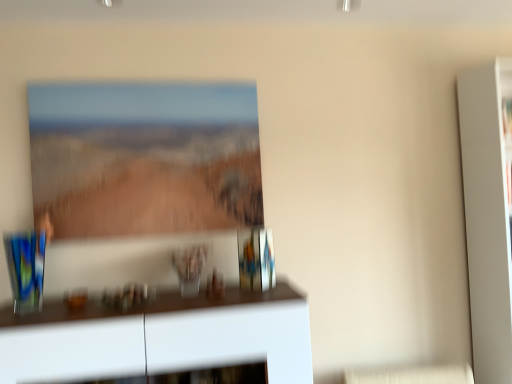
Question: Based on their sizes in the image, would you say translucent glass vase at center is bigger or smaller than matte glass picture frame at upper center?

Choices:
 (A) small
 (B) big

Answer: (A)

Question: From the image's perspective, is translucent glass vase at center above or below matte glass picture frame at upper center?

Choices:
 (A) below
 (B) above

Answer: (A)

Question: Estimate the real-world distances between objects in this image. Which object is farther from the translucent glass vase at center?

Choices:
 (A) matte glass picture frame at upper center
 (B) white glossy cabinet at lower center

Answer: (A)

Question: Which object is the farthest from the translucent glass vase at center?

Choices:
 (A) matte glass picture frame at upper center
 (B) white glossy cabinet at lower center

Answer: (A)